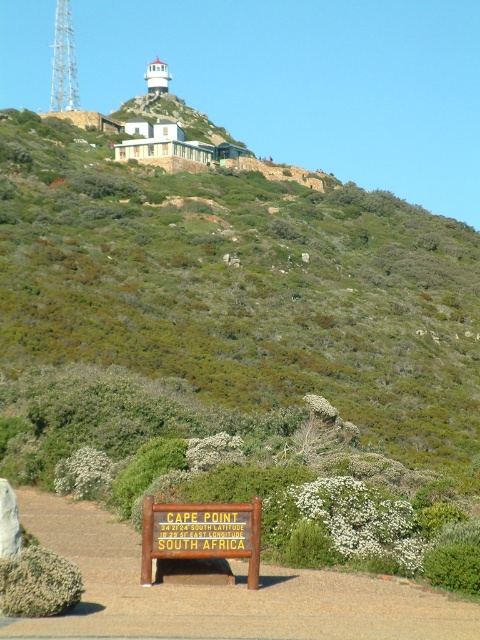
You are standing at the wooden signboard with yellow text in the foreground of the Cape Point scene. Looking towards the upper center area, can you see the green shrubbery at upper center? Please explain based on the coordinates provided.

Yes, the green shrubbery at upper center is located at coordinates point (242, 289), which is within the upper center area of the scene, so it should be visible from the wooden signboard in the foreground.

You are a hiker standing at the brown wooden sign at lower center. Looking towards the green shrubbery at upper center, do you need to look up or down to see the top of the shrubbery?

The green shrubbery at upper center is taller than the brown wooden sign at lower center, so you need to look up to see the top of the shrubbery.